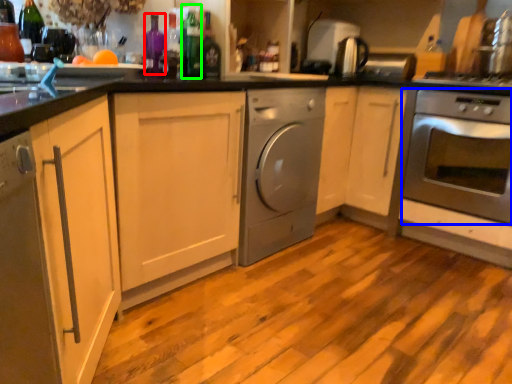
Question: Estimate the real-world distances between objects in this image. Which object is farther from bottle (highlighted by a red box), oven (highlighted by a blue box) or bottle (highlighted by a green box)?

Choices:
 (A) oven
 (B) bottle

Answer: (A)